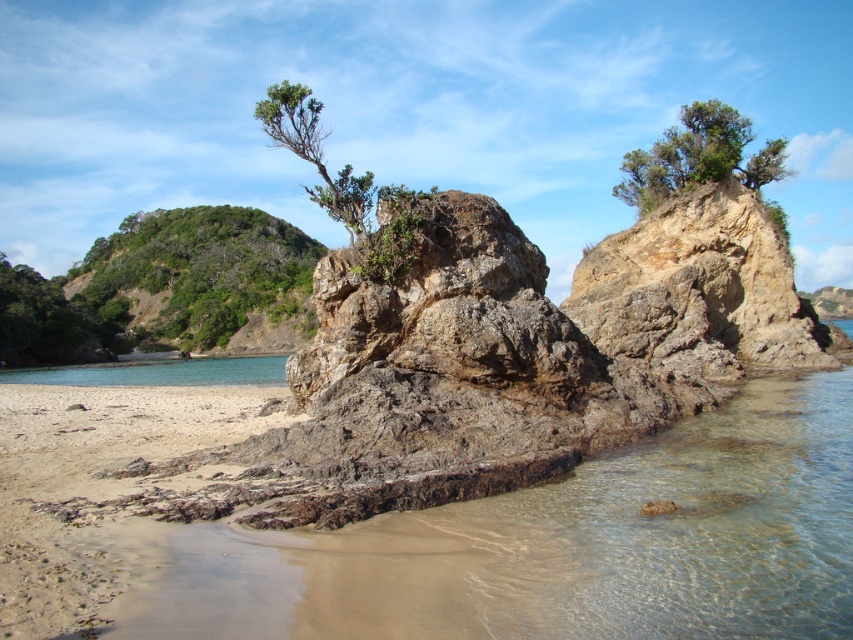
Question: Is green leafy tree at upper right wider than green leafy shrub at upper center?

Choices:
 (A) yes
 (B) no

Answer: (A)

Question: Does green leafy tree at upper left have a smaller size compared to green leafy tree at upper right?

Choices:
 (A) no
 (B) yes

Answer: (B)

Question: Can you confirm if green leafy tree at upper left is wider than green leafy tree at upper right?

Choices:
 (A) no
 (B) yes

Answer: (A)

Question: Which point is closer to the camera taking this photo?

Choices:
 (A) (309, 122)
 (B) (257, 282)

Answer: (A)

Question: Among these points, which one is farthest from the camera?

Choices:
 (A) (323, 163)
 (B) (782, 176)
 (C) (115, 262)

Answer: (C)

Question: Which point is closer to the camera?

Choices:
 (A) (279, 125)
 (B) (91, 262)

Answer: (A)